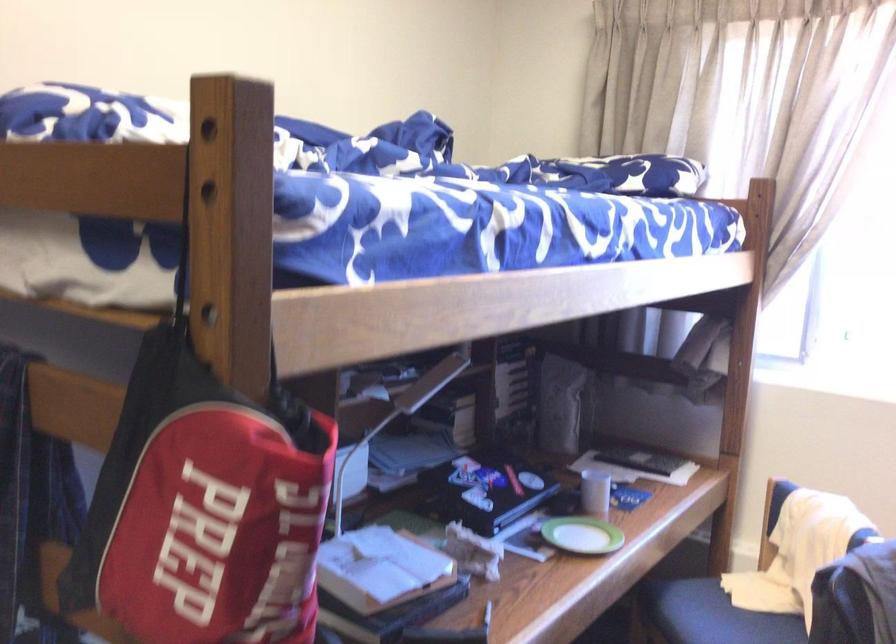
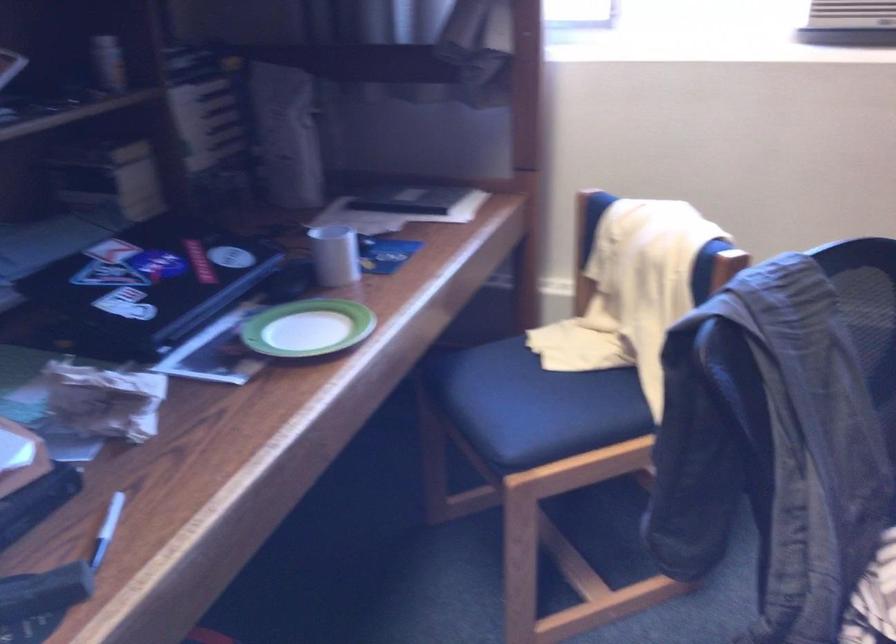
Question: Which direction would the cameraman need to move to produce the second image? Reply with the corresponding letter.

Choices:
 (A) Left
 (B) Right
 (C) Forward
 (D) Backward

Answer: (C)